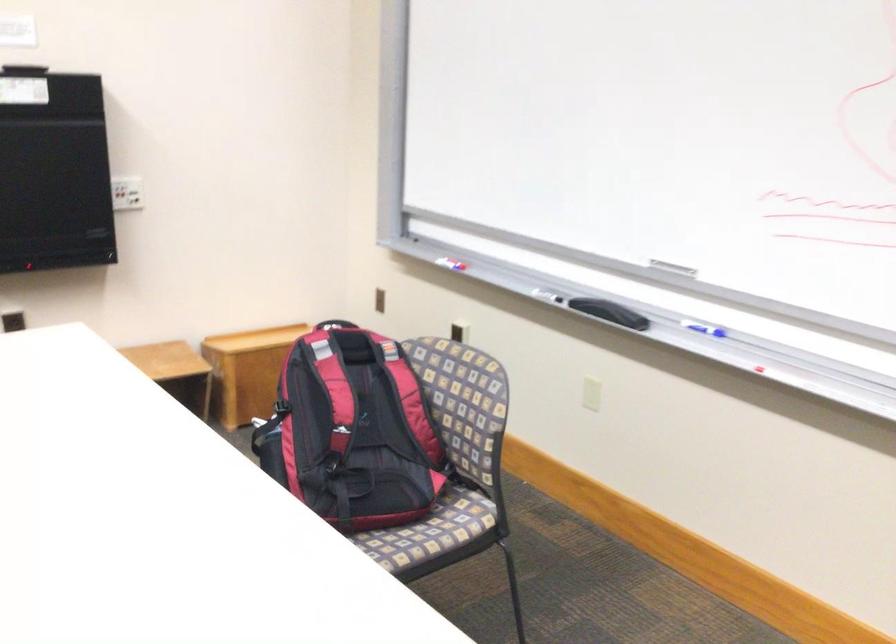
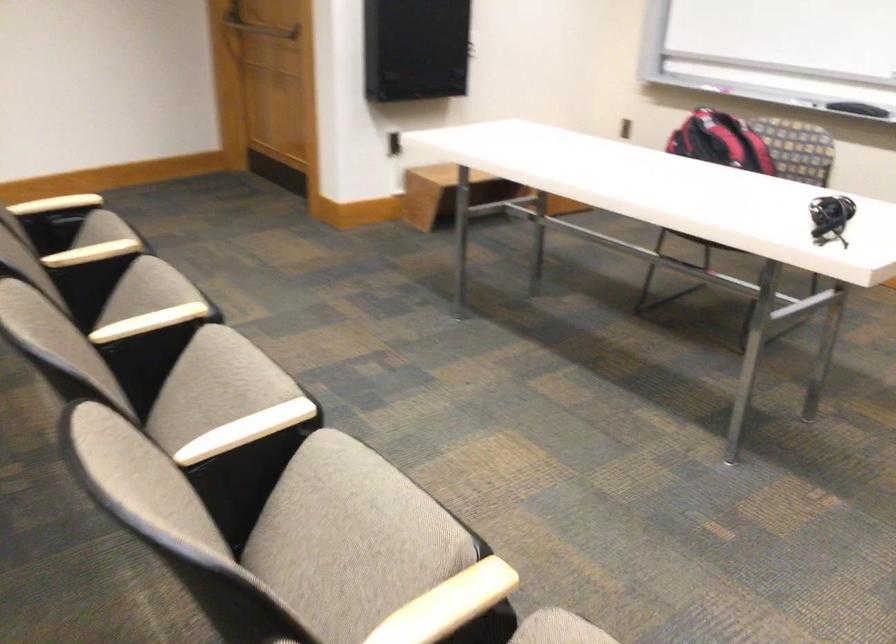
In the second image, find the point that corresponds to (328,400) in the first image.

(720, 142)